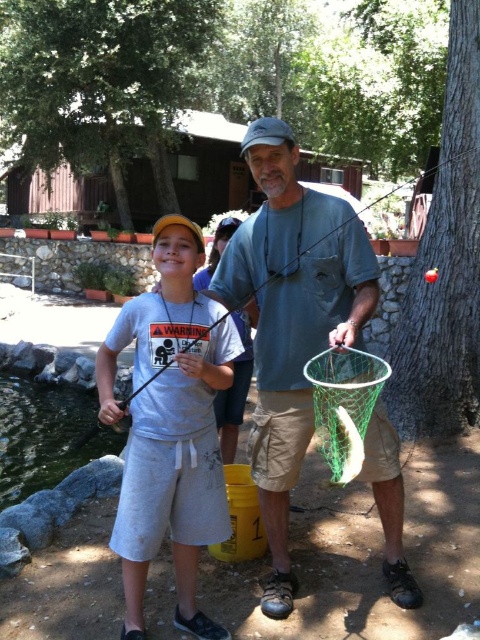
Question: Does gray cotton t-shirt at center appear over green mesh fishing net at center?

Choices:
 (A) yes
 (B) no

Answer: (B)

Question: Which point is closer to the camera?

Choices:
 (A) green mesh fishing net at center
 (B) green mesh net at center
 (C) white matte fish at center

Answer: (A)

Question: Is green mesh fishing net at center below green mesh net at center?

Choices:
 (A) no
 (B) yes

Answer: (B)

Question: Considering the relative positions of green mesh fishing net at center and white matte fish at center in the image provided, where is green mesh fishing net at center located with respect to white matte fish at center?

Choices:
 (A) left
 (B) right

Answer: (B)

Question: Which is nearer to the green mesh net at center?

Choices:
 (A) gray cotton t-shirt at center
 (B) green mesh fishing net at center

Answer: (B)

Question: Estimate the real-world distances between objects in this image. Which object is farther from the green mesh fishing net at center?

Choices:
 (A) gray cotton t-shirt at center
 (B) green mesh net at center

Answer: (B)